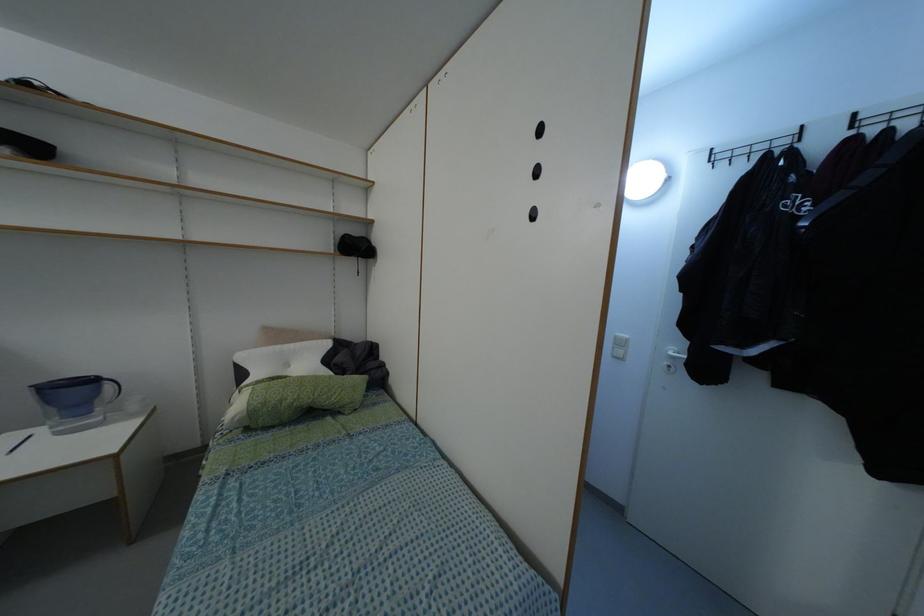
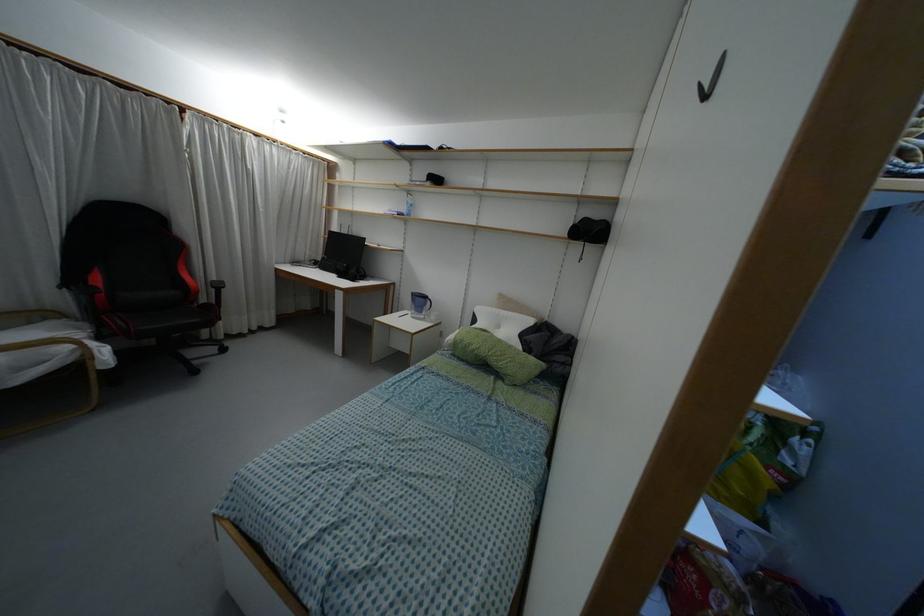
In the second image, find the point that corresponds to point (276, 346) in the first image.

(496, 310)